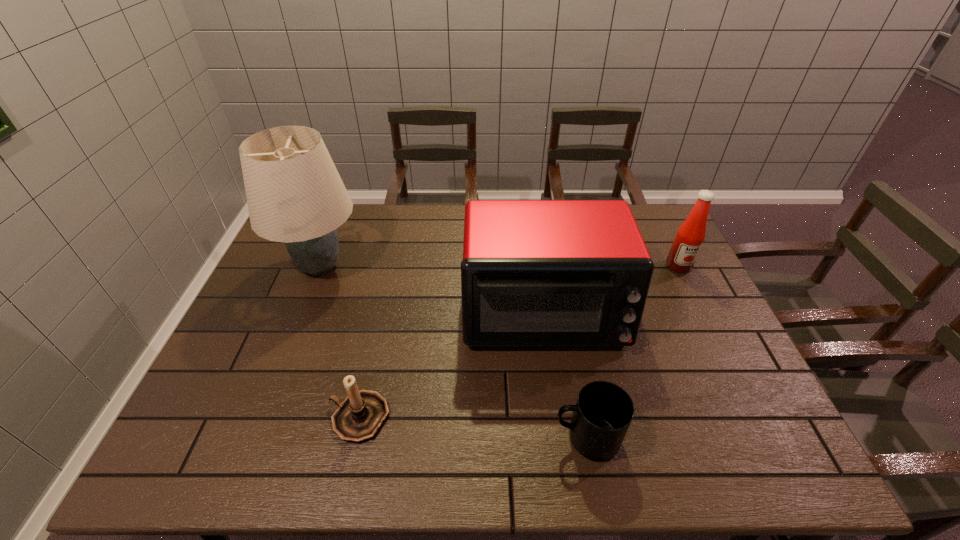
The height and width of the screenshot is (540, 960). I want to click on free location located on the side of the shortest object with the handle, so click(x=481, y=438).

Locate an element on the screen. This screenshot has height=540, width=960. vacant point located 0.370m on the side of the shortest object with the handle is located at coordinates (387, 438).

Where is `free region located on the side of the shortest object with the handle`? The width and height of the screenshot is (960, 540). free region located on the side of the shortest object with the handle is located at coordinates (445, 438).

Identify the location of object situated at the far edge. (295, 195).

Where is `candle holder that is at the near edge`? This screenshot has width=960, height=540. candle holder that is at the near edge is located at coordinates (359, 417).

What are the coordinates of `mug at the near edge` in the screenshot? It's located at click(602, 415).

This screenshot has height=540, width=960. In order to click on object located at the left edge in this screenshot , I will do `click(295, 195)`.

I want to click on object that is positioned at the right edge, so click(x=690, y=236).

This screenshot has height=540, width=960. What are the coordinates of `object present at the far left corner` in the screenshot? It's located at [295, 195].

This screenshot has height=540, width=960. What are the coordinates of `vacant space at the far edge of the desktop` in the screenshot? It's located at (422, 244).